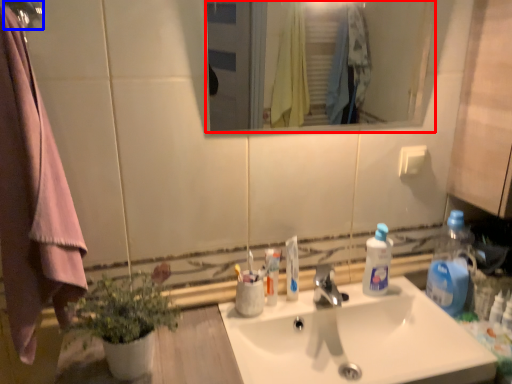
Question: Which object is closer to the camera taking this photo, mirror (highlighted by a red box) or shower (highlighted by a blue box)?

Choices:
 (A) mirror
 (B) shower

Answer: (B)